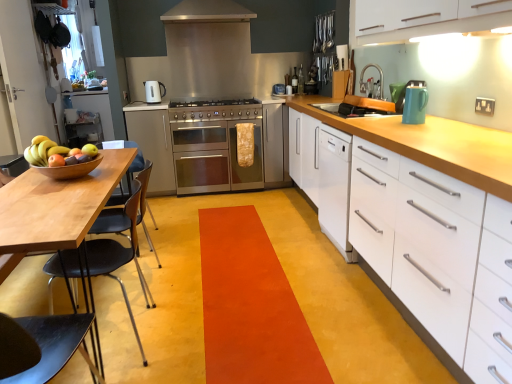
Question: From a real-world perspective, is wooden bowl at left above or below stainless steel oven at center, placed as the second cabinetry when sorted from front to back?

Choices:
 (A) above
 (B) below

Answer: (A)

Question: Based on their positions, is wooden bowl at left located to the left or right of stainless steel oven at center, placed as the second cabinetry when sorted from front to back?

Choices:
 (A) left
 (B) right

Answer: (B)

Question: Which of these objects is positioned closest to the wooden bowl at left?

Choices:
 (A) stainless steel oven at center, placed as the second cabinetry when sorted from front to back
 (B) white matte dishwasher at center-right
 (C) white matte cabinet at right, positioned as the 3th cabinetry in back-to-front order
 (D) teal glossy kettle at upper right, which is counted as the first kitchen appliance, starting from the right
 (E) brushed metal faucet at upper center

Answer: (B)

Question: Estimate the real-world distances between objects in this image. Which object is farther from the white matte cabinet at right, which ranks as the 1th cabinetry in front-to-back order?

Choices:
 (A) stainless steel oven at center
 (B) white matte dishwasher at center-right
 (C) brushed metal faucet at upper center
 (D) wooden bowl at left
 (E) white glossy electric kettle at upper center, the first kitchen appliance from the left

Answer: (E)